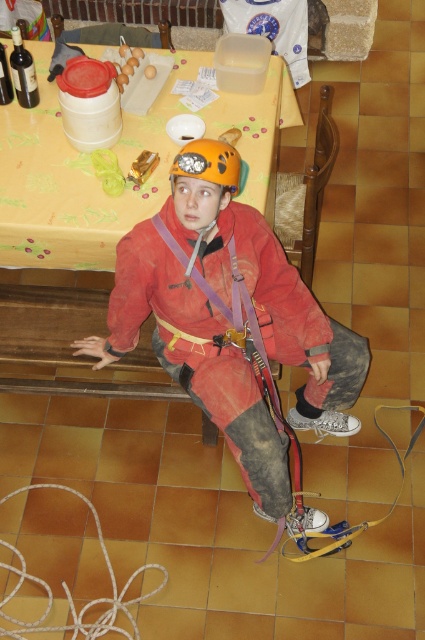
Question: Does matte orange helmet at center come behind red matte safety vest at center?

Choices:
 (A) no
 (B) yes

Answer: (A)

Question: Which object is positioned farthest from the orange matte helmet at center?

Choices:
 (A) red matte safety vest at center
 (B) matte orange helmet at center
 (C) white rope at lower left

Answer: (C)

Question: Which object is positioned farthest from the red matte safety vest at center?

Choices:
 (A) yellow plastic table at upper center
 (B) orange matte helmet at center
 (C) white rope at lower left
 (D) matte orange helmet at center

Answer: (C)

Question: Among these objects, which one is farthest from the camera?

Choices:
 (A) yellow plastic table at upper center
 (B) red matte safety vest at center

Answer: (A)

Question: Does white rope at lower left appear under red matte safety vest at center?

Choices:
 (A) no
 (B) yes

Answer: (B)

Question: Does yellow plastic table at upper center appear over red matte safety vest at center?

Choices:
 (A) no
 (B) yes

Answer: (B)